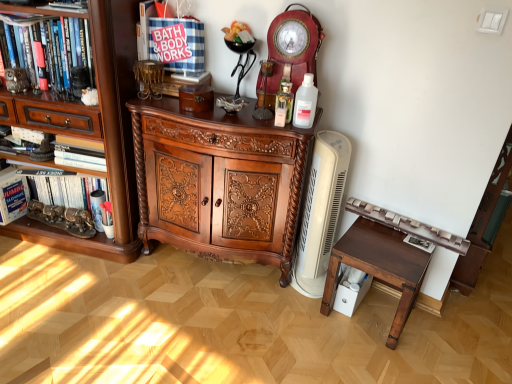
Where is `free space in front of brown wood cabinet at left`? free space in front of brown wood cabinet at left is located at coordinates (62, 301).